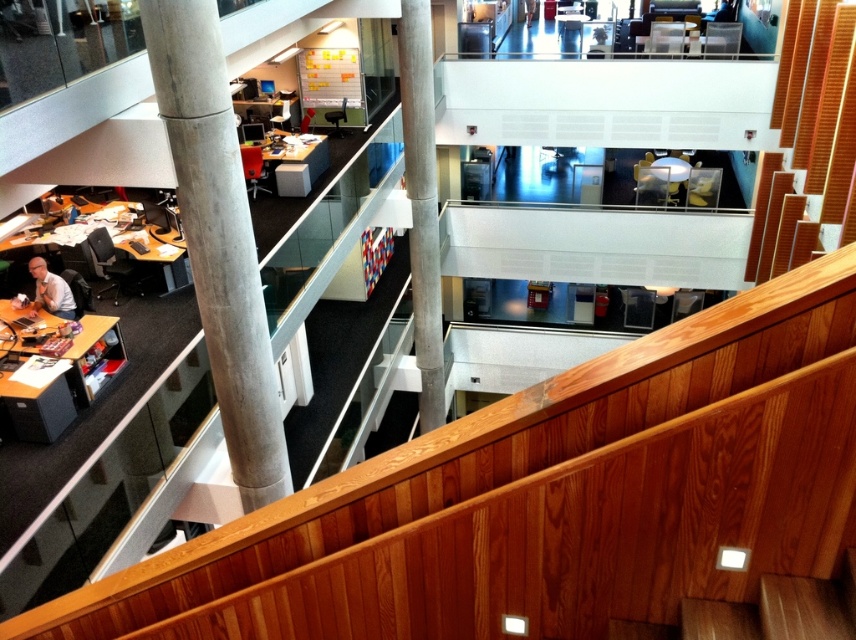
You are an office worker needing to carry a large box that is 2 meters wide. You see the wooden stairs at upper center and the concrete pillar at center. Which one can accommodate the width of your box?

The wooden stairs at upper center can accommodate the width of the large box since its width is larger than the concrete pillar at center.

You are an office worker who needs to move from the wooden stairs at upper center to the matte black desk at lower left. Can you walk directly to the desk without needing to go around any obstacles?

The wooden stairs at upper center and matte black desk at lower left are 7.67 meters apart, so yes, you can walk directly to the desk without needing to go around any obstacles since there is no mention of obstacles between them in the scene description.